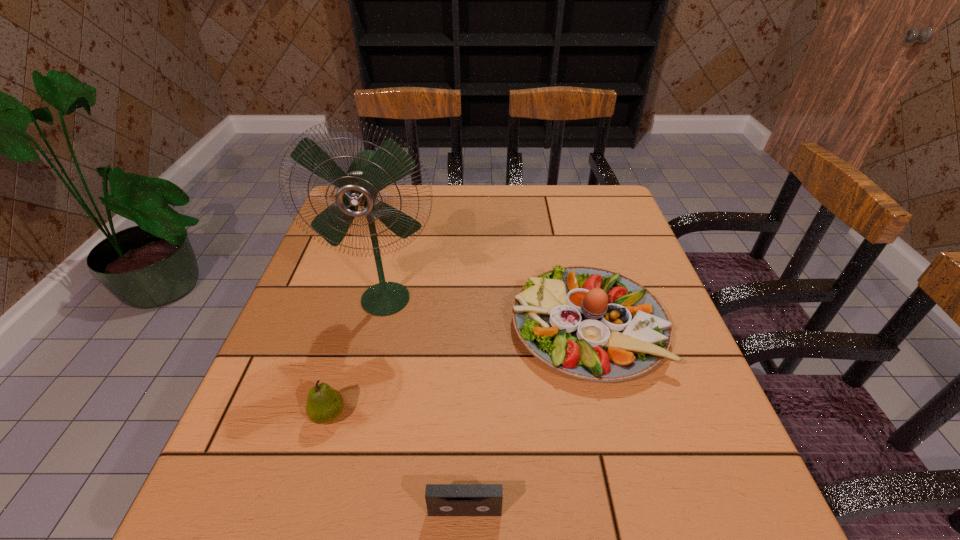
You are a GUI agent. You are given a task and a screenshot of the screen. Output one action in this format:
    pyautogui.click(x=<x>, y=<y>)
    Task: Click on the object situated at the near edge
    Image resolution: width=960 pixels, height=540 pixels.
    Given the screenshot: What is the action you would take?
    pyautogui.click(x=441, y=499)

The height and width of the screenshot is (540, 960). I want to click on fan situated at the left edge, so click(370, 172).

Image resolution: width=960 pixels, height=540 pixels. Identify the location of pear located in the left edge section of the desktop. [324, 405].

The height and width of the screenshot is (540, 960). Find the location of `object at the right edge`. object at the right edge is located at coordinates (593, 324).

I want to click on vacant area at the far edge, so (x=505, y=224).

Locate an element on the screen. This screenshot has height=540, width=960. vacant space at the near edge of the desktop is located at coordinates (585, 532).

In the image, there is a desktop. Identify the location of vacant space at the left edge. The image size is (960, 540). (336, 305).

In the image, there is a desktop. Where is `blank space at the right edge`? This screenshot has height=540, width=960. blank space at the right edge is located at coordinates (661, 400).

You are a GUI agent. You are given a task and a screenshot of the screen. Output one action in this format:
    pyautogui.click(x=<x>, y=<y>)
    Task: Click on the vacant area at the near left corner of the desktop
    The height and width of the screenshot is (540, 960).
    Given the screenshot: What is the action you would take?
    coord(231,502)

Locate an element on the screen. Image resolution: width=960 pixels, height=540 pixels. free spot at the far right corner of the desktop is located at coordinates (614, 218).